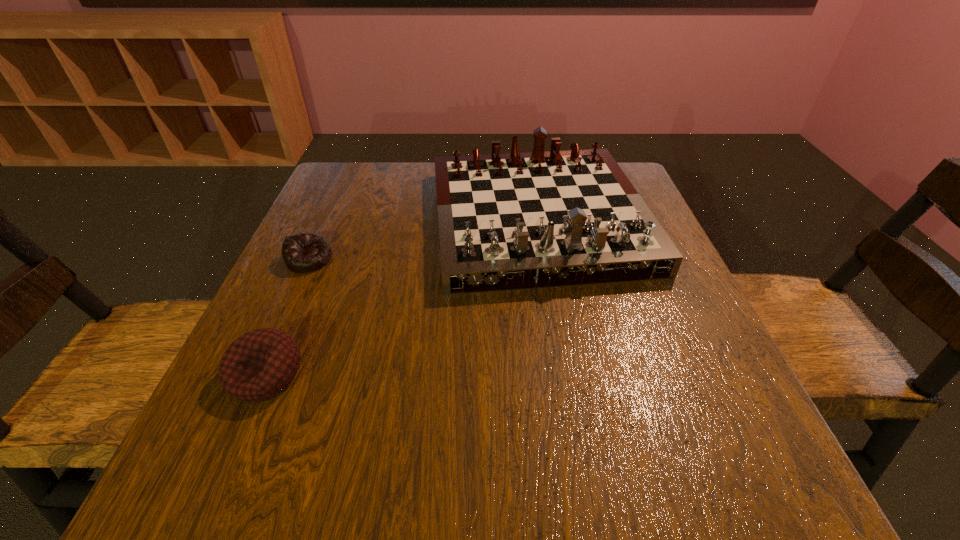
Identify the location of the tallest object. (515, 221).

Find the location of a particular element. This screenshot has height=540, width=960. gameboard is located at coordinates (515, 221).

Locate an element on the screen. The width and height of the screenshot is (960, 540). the nearest object is located at coordinates (260, 364).

The width and height of the screenshot is (960, 540). Find the location of `the nearer beanbag`. the nearer beanbag is located at coordinates (260, 364).

This screenshot has width=960, height=540. In order to click on the shorter beanbag in this screenshot , I will do `click(303, 252)`.

Locate an element on the screen. Image resolution: width=960 pixels, height=540 pixels. the shortest object is located at coordinates (303, 252).

This screenshot has width=960, height=540. In order to click on free point located 0.230m on the left of the rightmost object in this screenshot , I will do `click(328, 219)`.

Identify the location of vacant region located on the right of the taller beanbag. The height and width of the screenshot is (540, 960). (443, 375).

Identify the location of vacant space located on the front of the farther beanbag. (286, 310).

This screenshot has height=540, width=960. What are the coordinates of `object at the far edge` in the screenshot? It's located at (515, 221).